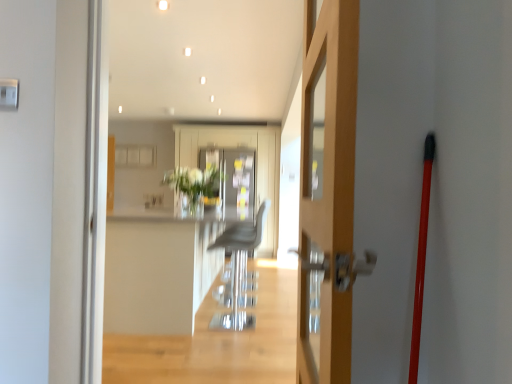
Question: Is white glossy counter top at center positioned with its back to translucent glass vase at center?

Choices:
 (A) yes
 (B) no

Answer: (B)

Question: Is white glossy counter top at center shorter than translucent glass vase at center?

Choices:
 (A) yes
 (B) no

Answer: (B)

Question: Is white glossy counter top at center placed right next to translucent glass vase at center?

Choices:
 (A) no
 (B) yes

Answer: (A)

Question: Does white glossy counter top at center have a greater width compared to translucent glass vase at center?

Choices:
 (A) no
 (B) yes

Answer: (B)

Question: Can you confirm if white glossy counter top at center is positioned to the left of translucent glass vase at center?

Choices:
 (A) no
 (B) yes

Answer: (B)

Question: Relative to white glossy counter top at center, is wooden door at center in front or behind?

Choices:
 (A) front
 (B) behind

Answer: (A)

Question: Considering the positions of wooden door at center and white glossy counter top at center in the image, is wooden door at center bigger or smaller than white glossy counter top at center?

Choices:
 (A) small
 (B) big

Answer: (A)

Question: From the image's perspective, is wooden door at center positioned above or below white glossy counter top at center?

Choices:
 (A) above
 (B) below

Answer: (A)

Question: In terms of width, does wooden door at center look wider or thinner when compared to white glossy counter top at center?

Choices:
 (A) thin
 (B) wide

Answer: (A)

Question: Based on their sizes in the image, would you say metallic gray armchair at center is bigger or smaller than white glossy counter top at center?

Choices:
 (A) small
 (B) big

Answer: (A)

Question: From a real-world perspective, is metallic gray armchair at center above or below white glossy counter top at center?

Choices:
 (A) above
 (B) below

Answer: (A)

Question: From the image's perspective, is metallic gray armchair at center positioned above or below white glossy counter top at center?

Choices:
 (A) below
 (B) above

Answer: (B)

Question: Is metallic gray armchair at center situated inside white glossy counter top at center or outside?

Choices:
 (A) inside
 (B) outside

Answer: (A)

Question: Is metallic gray armchair at center inside the boundaries of translucent glass vase at center, or outside?

Choices:
 (A) outside
 (B) inside

Answer: (A)

Question: From their relative heights in the image, would you say metallic gray armchair at center is taller or shorter than translucent glass vase at center?

Choices:
 (A) tall
 (B) short

Answer: (A)